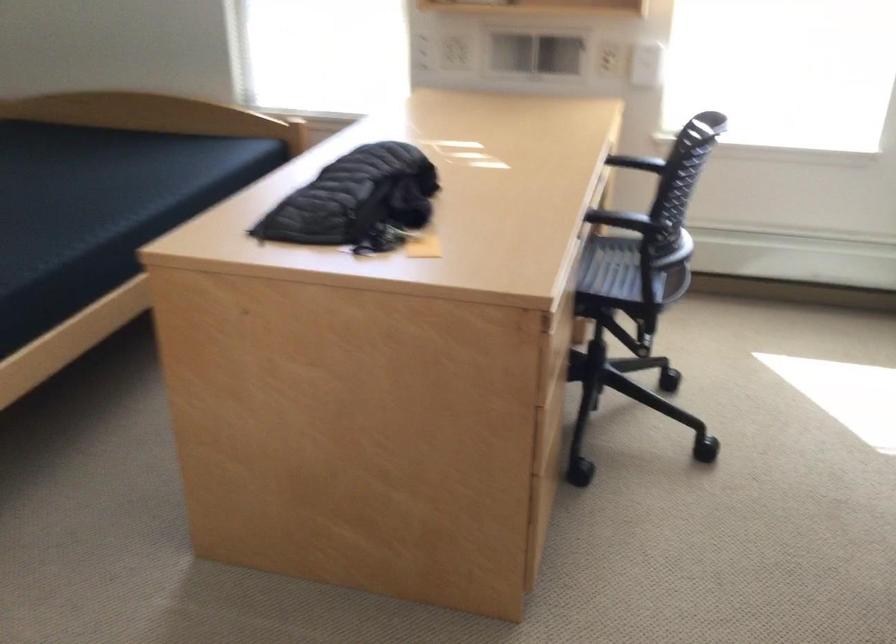
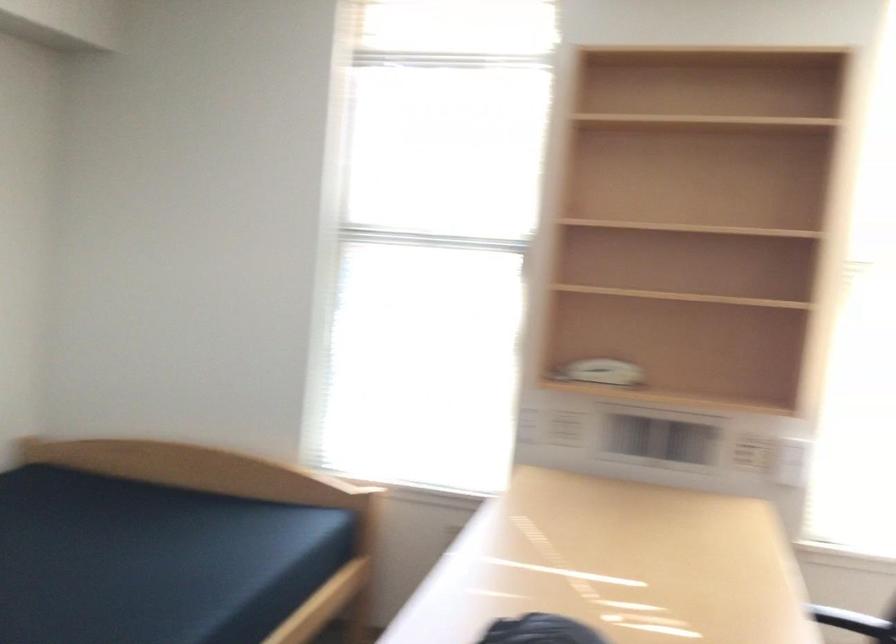
What movement of the cameraman would produce the second image?

The cameraman walked toward left, forward.